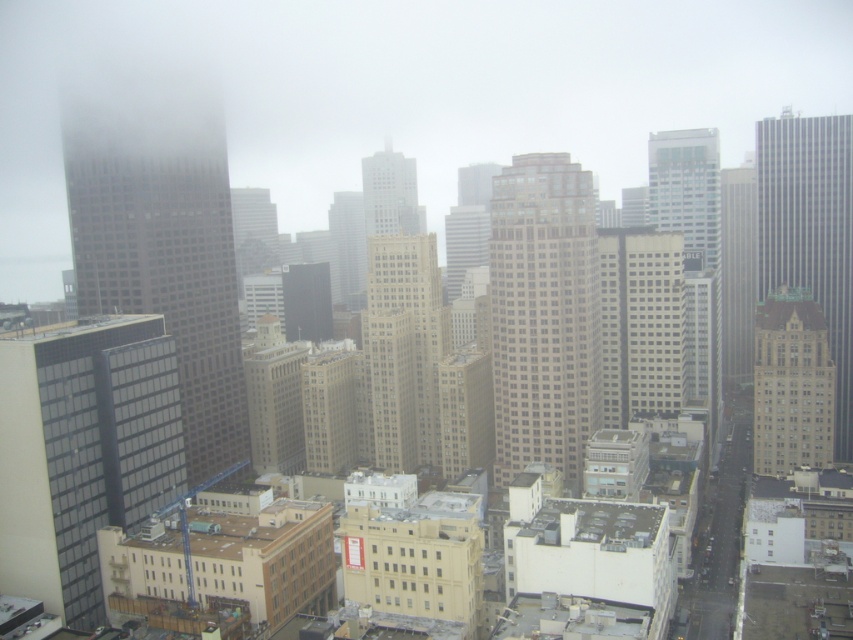
Question: Which is farther from the gray concrete skyscraper at center?

Choices:
 (A) beige stone building at center
 (B) beige stone building at center-right

Answer: (A)

Question: Is beige glass building at center wider than silver glass skyscraper at center-right?

Choices:
 (A) yes
 (B) no

Answer: (B)

Question: Estimate the real-world distances between objects in this image. Which object is closer to the beige stone building at center?

Choices:
 (A) matte glass building at lower left
 (B) silver glass skyscraper at center-right

Answer: (A)

Question: From the image, what is the correct spatial relationship of beige glass building at center in relation to beige stone building at center-right?

Choices:
 (A) left
 (B) right

Answer: (A)

Question: Which of the following is the closest to the observer?

Choices:
 (A) gray glass skyscraper at right
 (B) matte glass building at lower left
 (C) light beige glass skyscraper at center

Answer: (B)

Question: Does matte glass skyscraper at left have a larger size compared to gray concrete skyscraper at center?

Choices:
 (A) yes
 (B) no

Answer: (A)